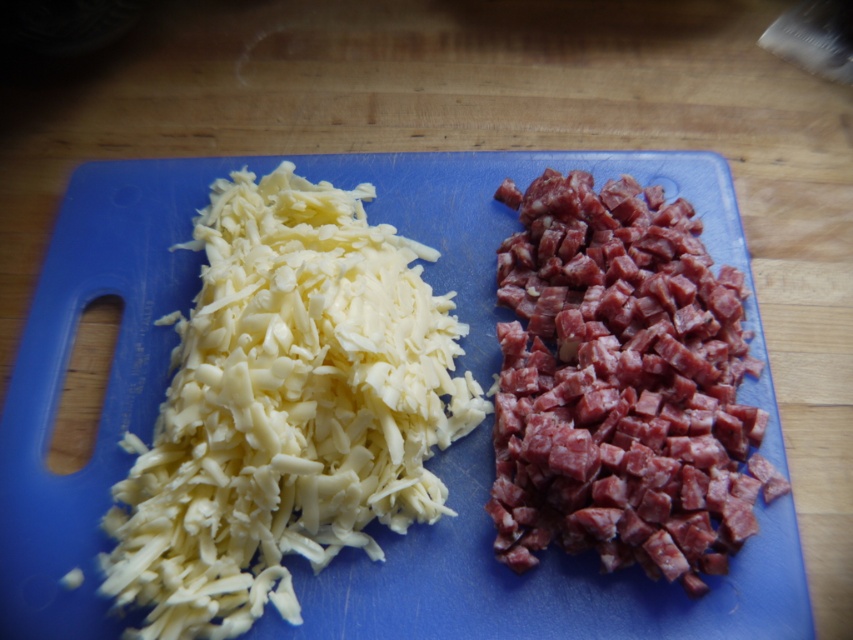
Question: In this image, where is white shredded cheese at left located relative to pinkish-red meat at right?

Choices:
 (A) left
 (B) right

Answer: (A)

Question: Which of the following is the farthest from the observer?

Choices:
 (A) (349, 541)
 (B) (633, 288)

Answer: (B)

Question: Does white shredded cheese at left appear on the left side of pinkish-red meat at right?

Choices:
 (A) yes
 (B) no

Answer: (A)

Question: Can you confirm if white shredded cheese at left is bigger than pinkish-red meat at right?

Choices:
 (A) no
 (B) yes

Answer: (B)

Question: Among these points, which one is nearest to the camera?

Choices:
 (A) (596, 490)
 (B) (125, 518)

Answer: (A)